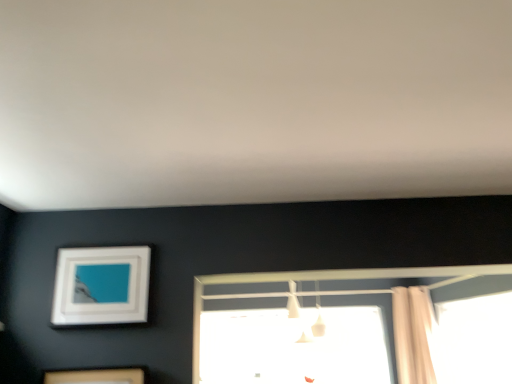
Question: Should I look upward or downward to see beige fabric shower curtain at right?

Choices:
 (A) up
 (B) down

Answer: (B)

Question: In which direction should I rotate to look at transparent glass window at center, positioned as the second window in back-to-front order?

Choices:
 (A) right
 (B) left

Answer: (A)

Question: Is the surface of transparent glass window at center, positioned as the first window in front-to-back order, in direct contact with white glossy picture frame at upper left?

Choices:
 (A) no
 (B) yes

Answer: (A)

Question: Is white glossy picture frame at upper left at the back of transparent glass window at center, the 1th window in the right-to-left sequence?

Choices:
 (A) yes
 (B) no

Answer: (B)

Question: Considering the relative positions of transparent glass window at center, positioned as the first window in front-to-back order, and white glossy picture frame at upper left in the image provided, is transparent glass window at center, positioned as the first window in front-to-back order, to the left of white glossy picture frame at upper left from the viewer's perspective?

Choices:
 (A) yes
 (B) no

Answer: (B)

Question: Considering the relative sizes of transparent glass window at center, positioned as the first window in front-to-back order, and white glossy picture frame at upper left in the image provided, is transparent glass window at center, positioned as the first window in front-to-back order, bigger than white glossy picture frame at upper left?

Choices:
 (A) no
 (B) yes

Answer: (B)

Question: Can you confirm if transparent glass window at center, positioned as the first window in front-to-back order, is smaller than white glossy picture frame at upper left?

Choices:
 (A) yes
 (B) no

Answer: (B)

Question: Is transparent glass window at center, positioned as the first window in front-to-back order, closer to camera compared to white glossy picture frame at upper left?

Choices:
 (A) yes
 (B) no

Answer: (B)

Question: Is beige fabric shower curtain at right turned away from transparent glass window at center, positioned as the first window in front-to-back order?

Choices:
 (A) no
 (B) yes

Answer: (B)

Question: From a real-world perspective, does beige fabric shower curtain at right sit lower than transparent glass window at center, positioned as the second window in back-to-front order?

Choices:
 (A) no
 (B) yes

Answer: (A)

Question: Is beige fabric shower curtain at right thinner than transparent glass window at center, the 1th window in the right-to-left sequence?

Choices:
 (A) yes
 (B) no

Answer: (B)

Question: Are beige fabric shower curtain at right and transparent glass window at center, arranged as the second window when viewed from the left, far apart?

Choices:
 (A) no
 (B) yes

Answer: (A)

Question: Does beige fabric shower curtain at right have a greater width compared to transparent glass window at center, arranged as the second window when viewed from the left?

Choices:
 (A) no
 (B) yes

Answer: (B)

Question: Would you say transparent glass window at center, arranged as the second window when viewed from the left, is part of beige fabric shower curtain at right's contents?

Choices:
 (A) no
 (B) yes

Answer: (A)

Question: From the image's perspective, does white matte light fixture at center appear lower than white glossy picture frame at upper left?

Choices:
 (A) yes
 (B) no

Answer: (A)